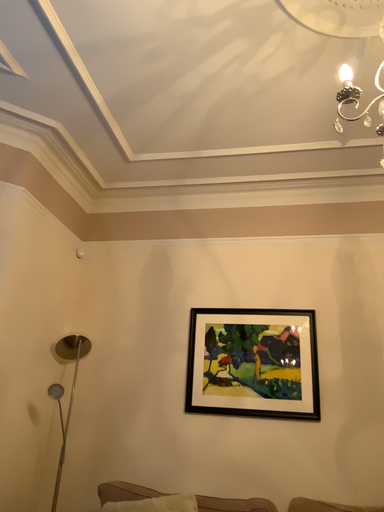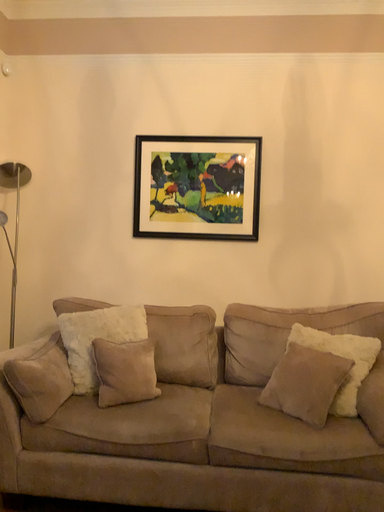
Question: How did the camera likely rotate when shooting the video?

Choices:
 (A) rotated downward
 (B) rotated upward

Answer: (A)